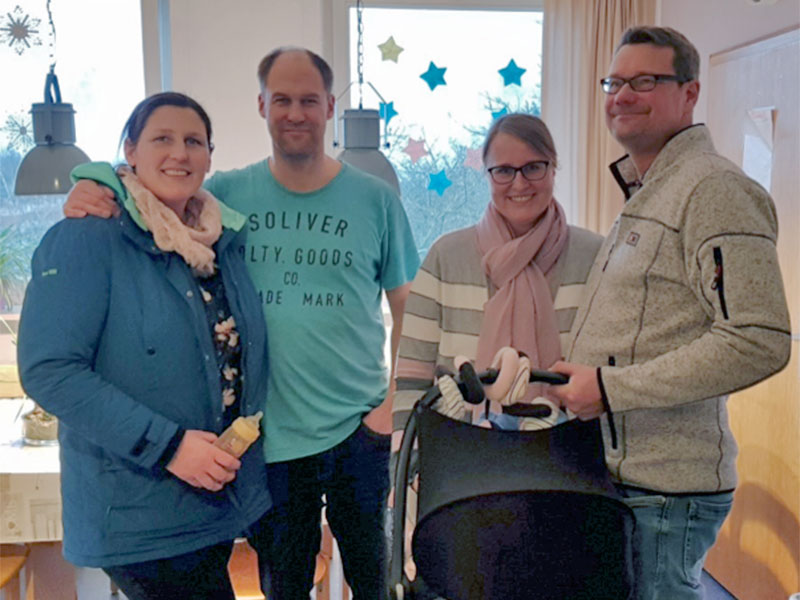
Locate an element on the screen. blue star cutout on window is located at coordinates (434, 183), (392, 110), (434, 80), (508, 73), (500, 111).